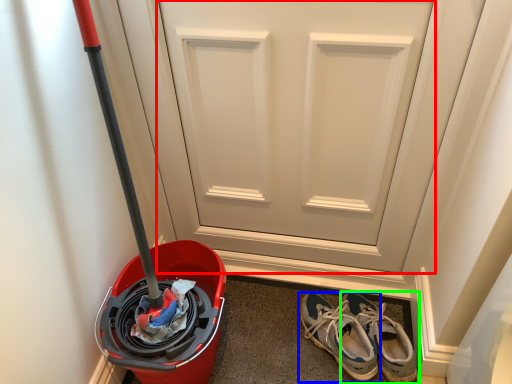
Question: Which object is positioned farthest from door (highlighted by a red box)? Select from footwear (highlighted by a blue box) and footwear (highlighted by a green box).

Choices:
 (A) footwear
 (B) footwear

Answer: (B)